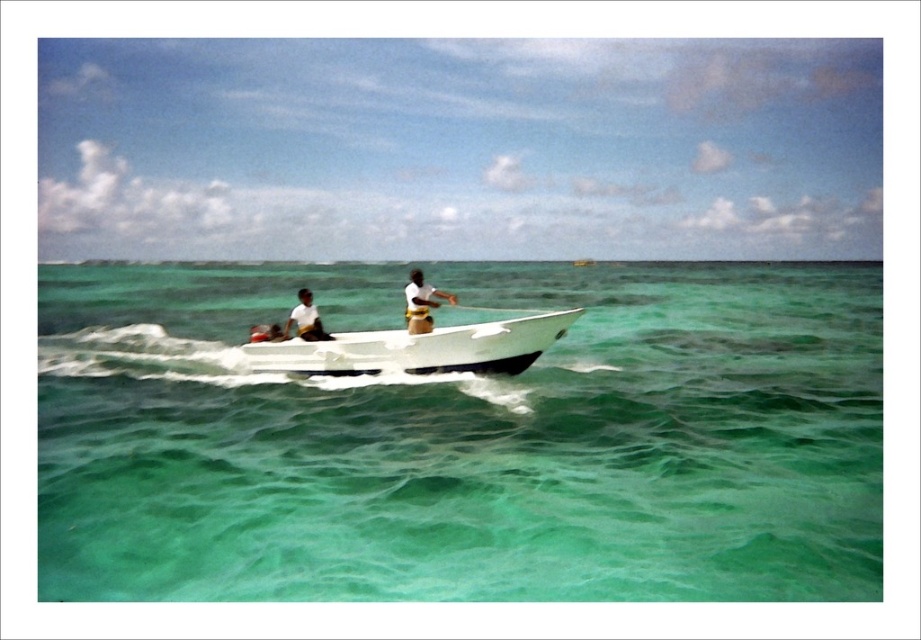
Looking at this image, you are a passenger on the white glossy boat at center. You want to jump into the clear green water at center for a swim. Considering the distance between the boat and the water, is it safe to jump directly from the boat into the water?

The clear green water at center is 20.63 meters from the white glossy boat at center. Jumping directly from the boat into the water at that distance would not be safe due to the large gap between them.

You are standing at the point marked as point (465, 440) in the image. What do you see directly in front of you?

You see clear green water at center directly in front of you at point (465, 440).